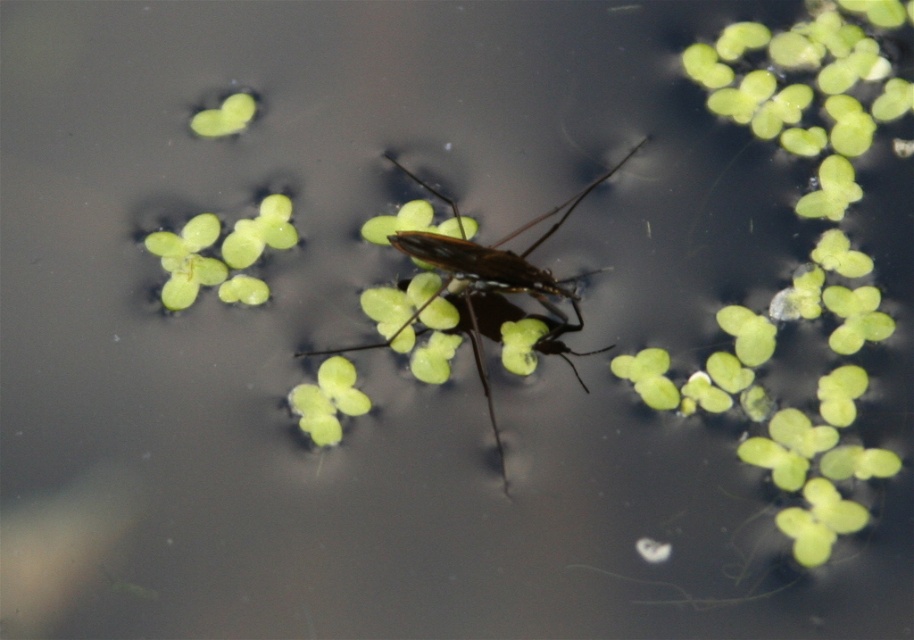
You are a water strider on the water surface. You want to move to the green leafy plant at upper left. Which direction should you go from your current position at point (x=187, y=259)?

The green leafy plant at upper left is located at point (x=187, y=259), so you are already at that location.

You are a small insect trying to reach the green leafy plant at upper left from the green matte leaf at center. Based on their positions, which direction should you move to get there?

The green leafy plant at upper left is located above the green matte leaf at center, so you should move upward to reach it.